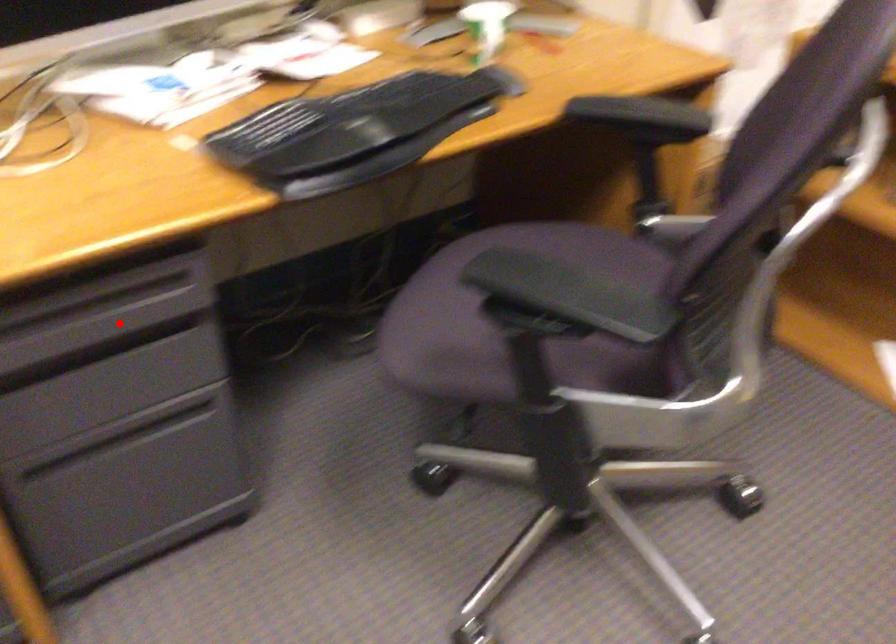
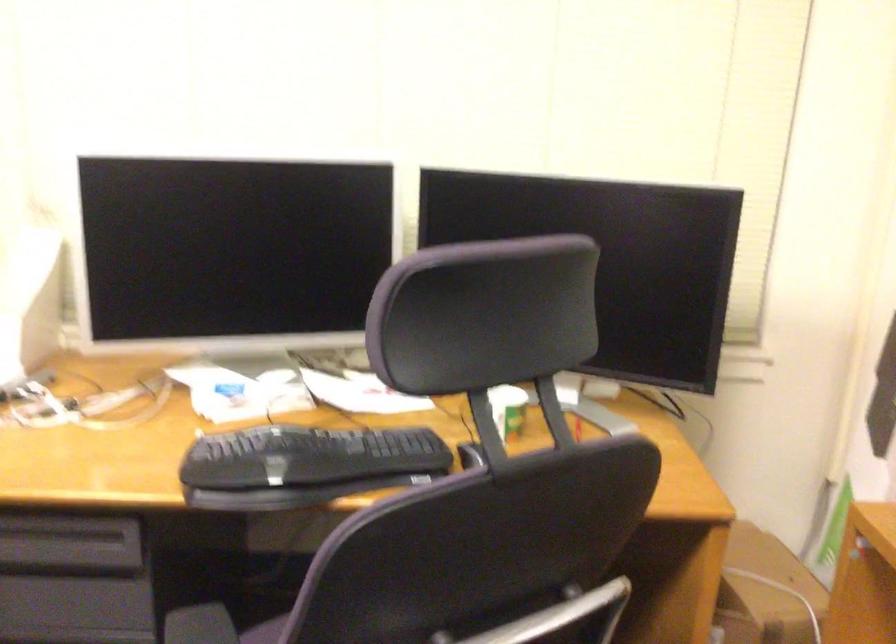
Question: I am providing you with two images of the same scene from different viewpoints. A red point is shown in image1. For the corresponding object point in image2, is it positioned nearer or farther from the camera?

Choices:
 (A) Nearer
 (B) Farther

Answer: (B)